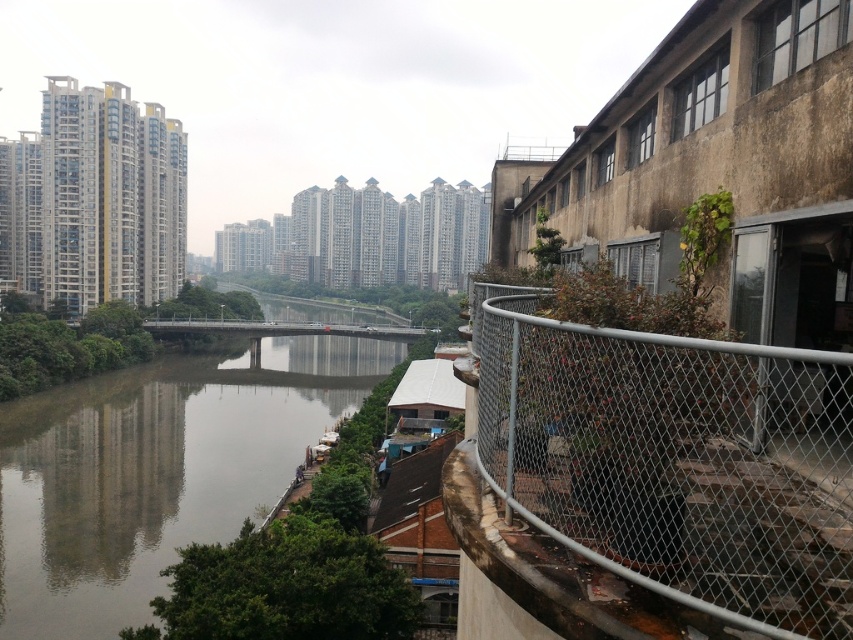
Can you confirm if silver chain-link fence at right is thinner than brown concrete river at center?

Yes.

Is silver chain-link fence at right to the left of brown concrete river at center from the viewer's perspective?

In fact, silver chain-link fence at right is to the right of brown concrete river at center.

Identify the location of silver chain-link fence at right. This screenshot has width=853, height=640. (675, 460).